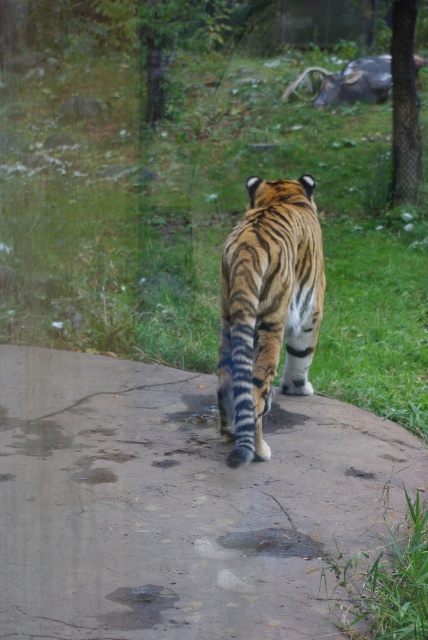
Is green grass at center below concrete wet pavement at center?

No, green grass at center is not below concrete wet pavement at center.

Is green grass at center thinner than concrete wet pavement at center?

No, green grass at center is not thinner than concrete wet pavement at center.

Is point (137, 248) behind point (109, 630)?

That is True.

You are a GUI agent. You are given a task and a screenshot of the screen. Output one action in this format:
    pyautogui.click(x=<x>, y=<y>)
    Task: Click on the green grass at center
    
    Given the screenshot: What is the action you would take?
    pyautogui.click(x=202, y=221)

Is the position of orange striped tiger at center more distant than that of gray metallic bull at upper center?

No, orange striped tiger at center is in front of gray metallic bull at upper center.

Is orange striped tiger at center wider than gray metallic bull at upper center?

No, orange striped tiger at center is not wider than gray metallic bull at upper center.

I want to click on orange striped tiger at center, so click(x=267, y=307).

Consider the image. Is green grass at center closer to camera compared to orange striped tiger at center?

No, green grass at center is further to the viewer.

Who is higher up, green grass at center or orange striped tiger at center?

green grass at center is above.

You are a GUI agent. You are given a task and a screenshot of the screen. Output one action in this format:
    pyautogui.click(x=<x>, y=<y>)
    Task: Click on the green grass at center
    This screenshot has width=428, height=640.
    Given the screenshot: What is the action you would take?
    pyautogui.click(x=202, y=221)